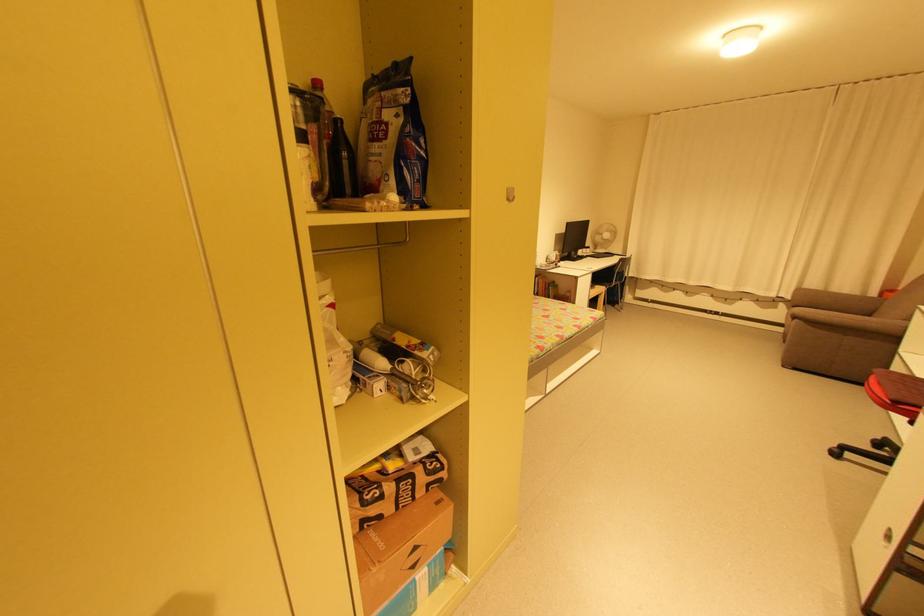
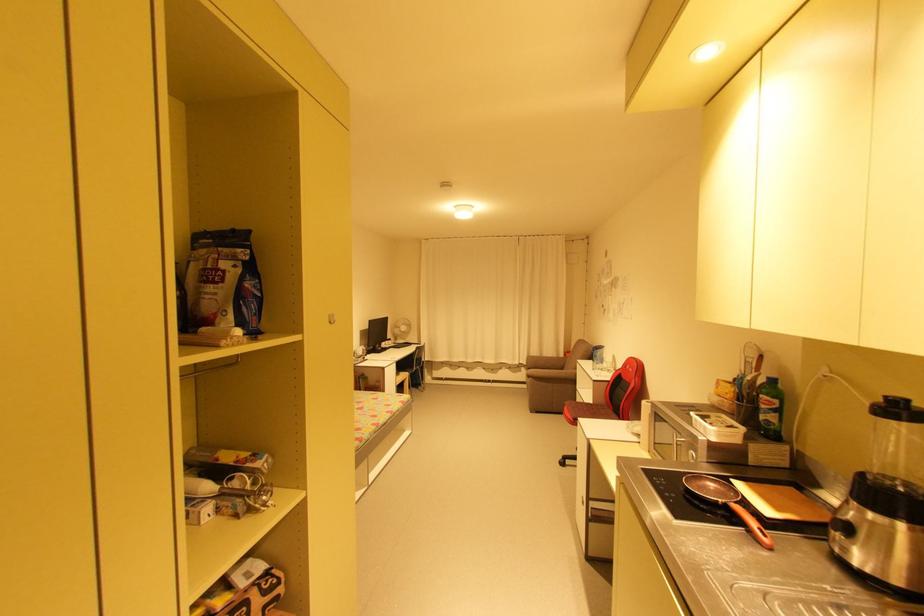
The point at (592, 249) is marked in the first image. Where is the corresponding point in the second image?

(395, 342)